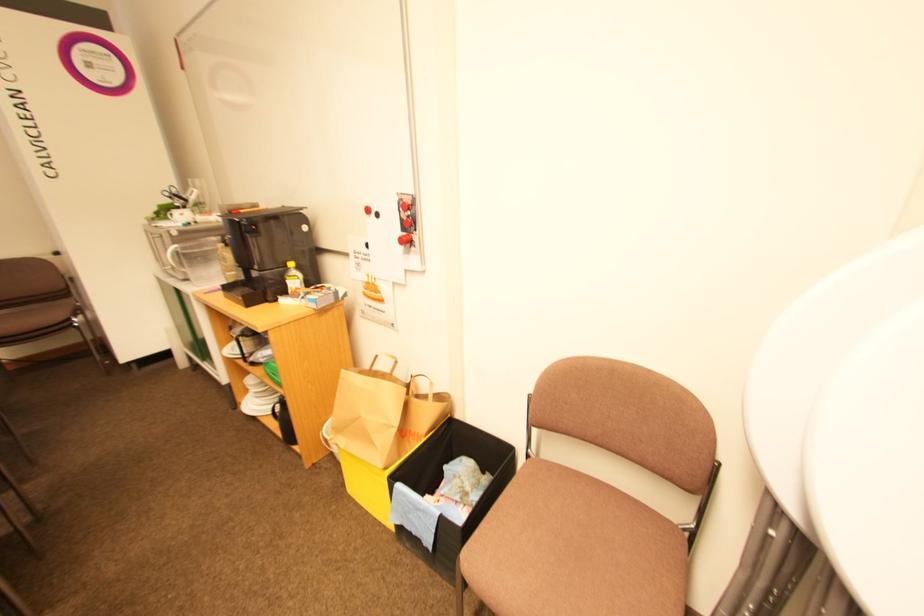
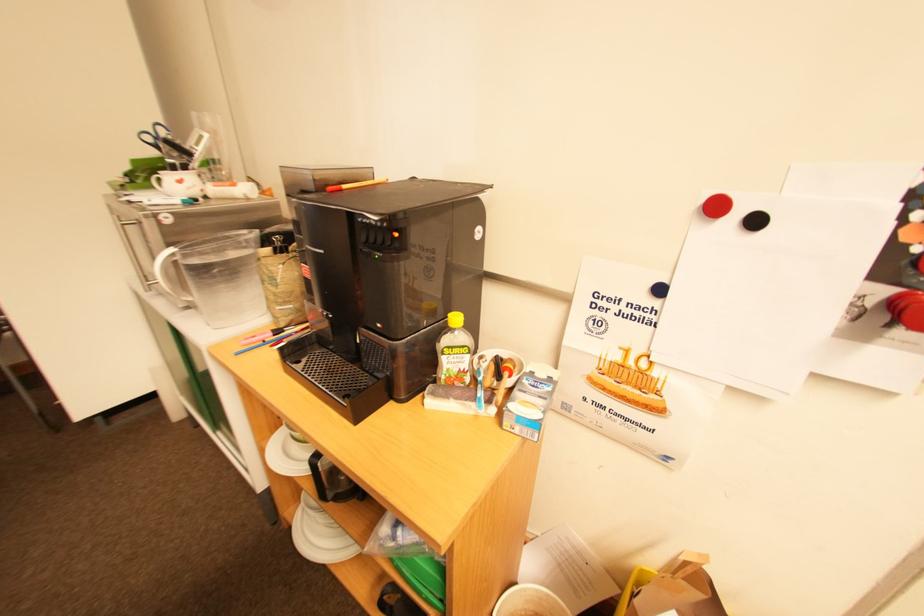
The images are taken continuously from a first-person perspective. In which direction are you moving?

The cameraman moved toward left, forward.